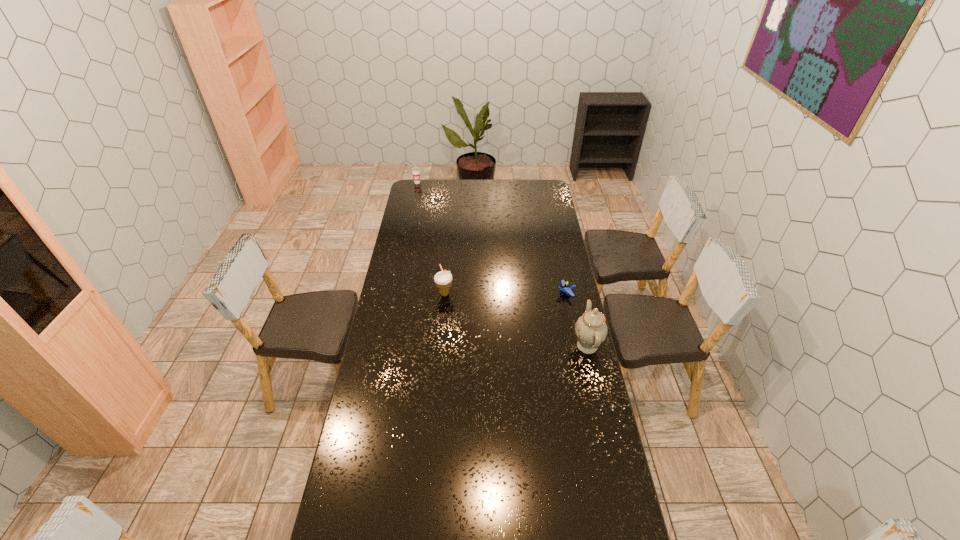
Identify the location of free space that satisfies the following two spatial constraints: 1. on the front side of the icecream; 2. on the right side of the farthest object. The height and width of the screenshot is (540, 960). (395, 294).

Find the location of a particular element. The width and height of the screenshot is (960, 540). blank area in the image that satisfies the following two spatial constraints: 1. on the front side of the farthest object; 2. on the spout of the chinaware is located at coordinates (384, 346).

In order to click on vacant region that satisfies the following two spatial constraints: 1. on the front side of the chinaware; 2. on the spout of the icecream in this screenshot , I will do `click(440, 346)`.